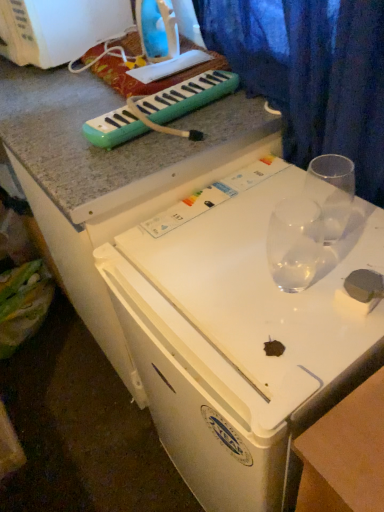
Question: Is the depth of clear glass martini glass at center, the 2th martini glass positioned from the right, greater than that of matte plastic iron at upper center, which is the first appliance from right to left?

Choices:
 (A) yes
 (B) no

Answer: (B)

Question: From the image's perspective, is clear glass martini glass at center, the 2th martini glass positioned from the right, under matte plastic iron at upper center, placed as the second appliance when sorted from left to right?

Choices:
 (A) yes
 (B) no

Answer: (A)

Question: Considering the relative sizes of clear glass martini glass at center, the 1th martini glass in the left-to-right sequence, and matte plastic iron at upper center, which is the first appliance from right to left, in the image provided, is clear glass martini glass at center, the 1th martini glass in the left-to-right sequence, smaller than matte plastic iron at upper center, which is the first appliance from right to left,?

Choices:
 (A) yes
 (B) no

Answer: (A)

Question: Does clear glass martini glass at center, the 2th martini glass positioned from the right, lie in front of matte plastic iron at upper center, placed as the second appliance when sorted from left to right?

Choices:
 (A) no
 (B) yes

Answer: (B)

Question: Is there a large distance between clear glass martini glass at center, the 2th martini glass positioned from the right, and matte plastic iron at upper center, which is the first appliance from right to left?

Choices:
 (A) yes
 (B) no

Answer: (B)

Question: Can you confirm if clear glass martini glass at center, the 2th martini glass positioned from the right, is positioned to the right of matte plastic iron at upper center, placed as the second appliance when sorted from left to right?

Choices:
 (A) no
 (B) yes

Answer: (B)

Question: From a real-world perspective, is matte plastic iron at upper center, which is the first appliance from right to left, physically above clear glass martini glass at center, the 2th martini glass positioned from the right?

Choices:
 (A) yes
 (B) no

Answer: (A)

Question: Considering the relative positions of matte plastic iron at upper center, which is the first appliance from right to left, and clear glass martini glass at center, the 1th martini glass in the left-to-right sequence, in the image provided, is matte plastic iron at upper center, which is the first appliance from right to left, to the right of clear glass martini glass at center, the 1th martini glass in the left-to-right sequence, from the viewer's perspective?

Choices:
 (A) no
 (B) yes

Answer: (A)

Question: Could you tell me if matte plastic iron at upper center, which is the first appliance from right to left, is facing clear glass martini glass at center, the 2th martini glass positioned from the right?

Choices:
 (A) yes
 (B) no

Answer: (B)

Question: Is matte plastic iron at upper center, placed as the second appliance when sorted from left to right, outside of clear glass martini glass at center, the 2th martini glass positioned from the right?

Choices:
 (A) yes
 (B) no

Answer: (A)

Question: Is matte plastic iron at upper center, placed as the second appliance when sorted from left to right, beside clear glass martini glass at center, the 2th martini glass positioned from the right?

Choices:
 (A) no
 (B) yes

Answer: (A)

Question: Is matte plastic iron at upper center, placed as the second appliance when sorted from left to right, at the left side of clear glass martini glass at center, the 2th martini glass positioned from the right?

Choices:
 (A) yes
 (B) no

Answer: (A)

Question: Would you say green plastic melodica at upper center is a long distance from transparent glass at upper right, the 2th martini glass viewed from the left?

Choices:
 (A) yes
 (B) no

Answer: (B)